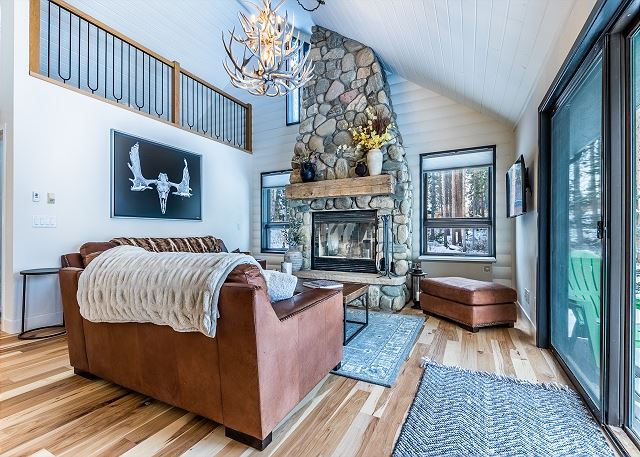
Image resolution: width=640 pixels, height=457 pixels. What are the coordinates of `window` in the screenshot? It's located at (292, 99), (273, 201), (275, 231), (444, 180), (491, 179), (443, 236), (467, 236).